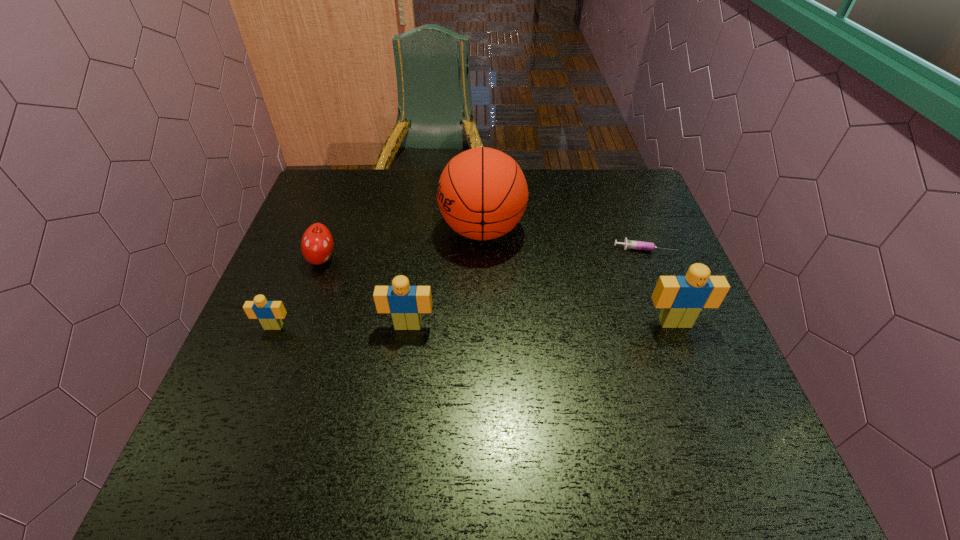
At what (x,y) coordinates should I click in order to perform the action: click on the leftmost Lego. Please return your answer as a coordinate pair (x, y). Looking at the image, I should click on (269, 313).

Where is `the second tallest Lego`? the second tallest Lego is located at coordinates (405, 303).

Locate an element on the screen. the fourth shortest object is located at coordinates (405, 303).

Identify the location of the rightmost Lego. The width and height of the screenshot is (960, 540). click(x=681, y=298).

Locate an element on the screen. This screenshot has height=540, width=960. syringe is located at coordinates (628, 244).

Where is `basketball`? The image size is (960, 540). basketball is located at coordinates (482, 193).

Where is `apple`? The image size is (960, 540). apple is located at coordinates (317, 244).

Find the location of a particular element. vacant space located 0.140m on the face of the shortest Lego is located at coordinates (250, 386).

This screenshot has height=540, width=960. I want to click on vacant space located on the face of the second shortest Lego, so click(398, 396).

Find the location of `free space located on the face of the rightmost Lego`. free space located on the face of the rightmost Lego is located at coordinates (692, 368).